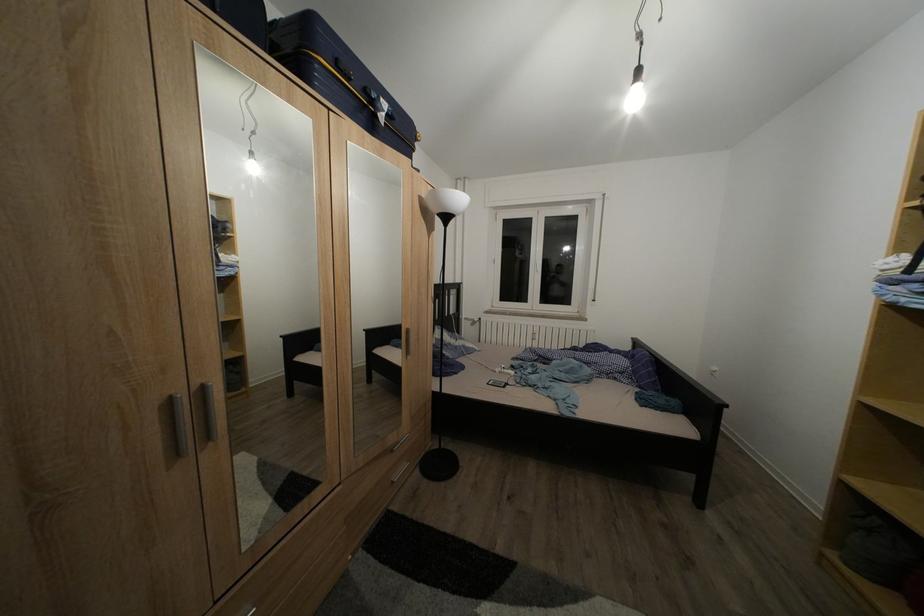
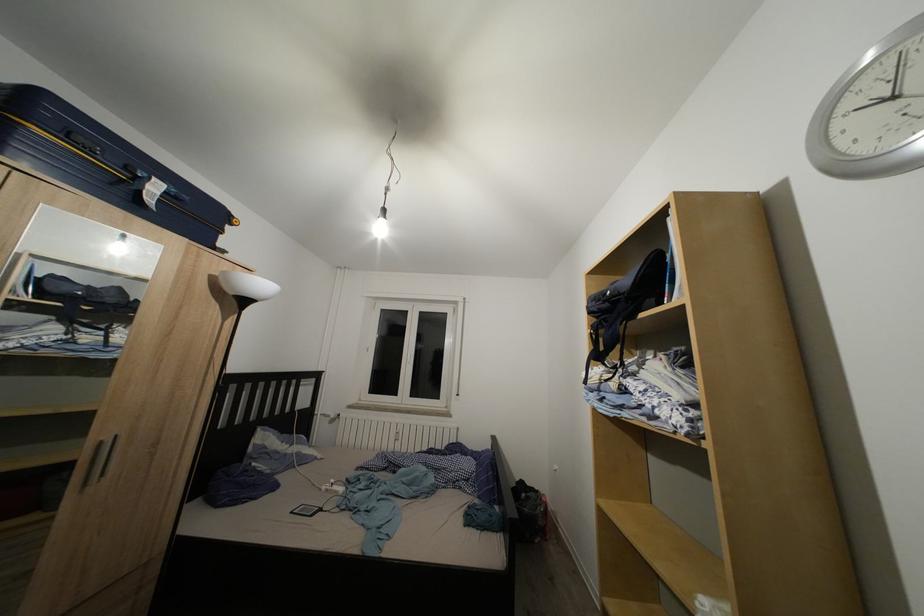
The first image is from the beginning of the video and the second image is from the end. How did the camera likely rotate when shooting the video?

The camera rotated toward right-up.